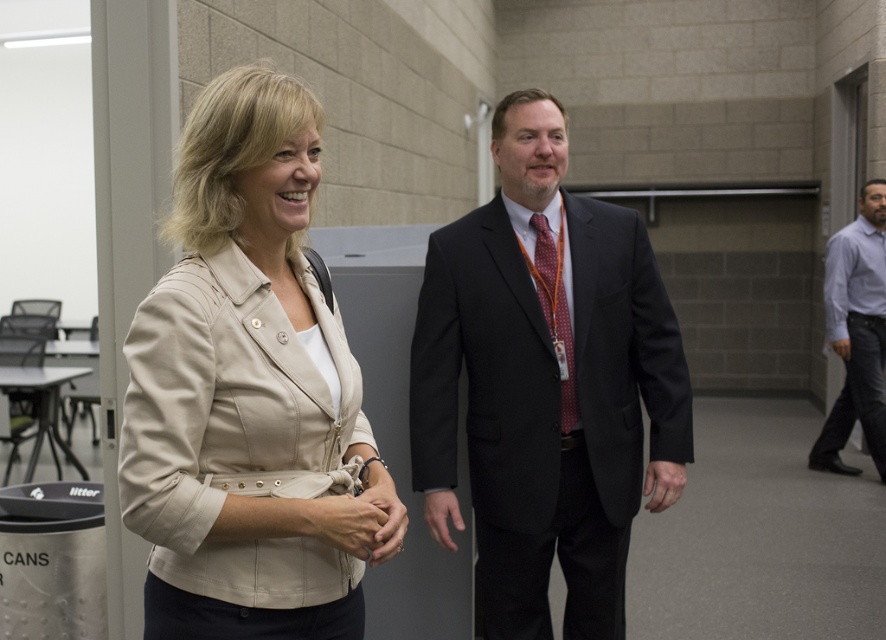
Is point (128, 330) positioned behind point (572, 540)?

That is False.

Is beige fabric jacket at center thinner than dark suit at center?

Indeed, beige fabric jacket at center has a lesser width compared to dark suit at center.

Describe the element at coordinates (249, 394) in the screenshot. The height and width of the screenshot is (640, 886). I see `beige fabric jacket at center` at that location.

Locate an element on the screen. beige fabric jacket at center is located at coordinates (249, 394).

Who is positioned more to the left, dark suit at center or light blue shirt at right?

From the viewer's perspective, dark suit at center appears more on the left side.

Can you confirm if dark suit at center is shorter than light blue shirt at right?

Yes, dark suit at center is shorter than light blue shirt at right.

Does point (605, 376) come closer to viewer compared to point (826, 464)?

That is True.

Identify the location of dark suit at center. (546, 385).

Can you confirm if dark suit at center is smaller than polka dot silk tie at center?

Actually, dark suit at center might be larger than polka dot silk tie at center.

Does dark suit at center have a larger size compared to polka dot silk tie at center?

Indeed, dark suit at center has a larger size compared to polka dot silk tie at center.

Measure the distance between dark suit at center and camera.

They are 7.46 feet apart.

I want to click on dark suit at center, so (546, 385).